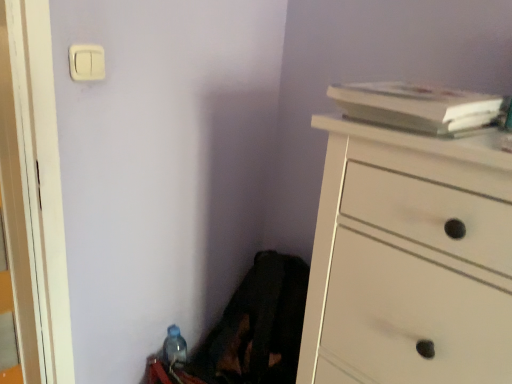
Question: Can we say translucent plastic bottle at lower left lies outside white matte book at upper right?

Choices:
 (A) yes
 (B) no

Answer: (A)

Question: From a real-world perspective, is translucent plastic bottle at lower left below white matte book at upper right?

Choices:
 (A) yes
 (B) no

Answer: (A)

Question: Does translucent plastic bottle at lower left have a lesser width compared to white matte book at upper right?

Choices:
 (A) yes
 (B) no

Answer: (A)

Question: Considering the relative sizes of translucent plastic bottle at lower left and white matte book at upper right in the image provided, is translucent plastic bottle at lower left smaller than white matte book at upper right?

Choices:
 (A) yes
 (B) no

Answer: (A)

Question: Is translucent plastic bottle at lower left facing towards white matte book at upper right?

Choices:
 (A) yes
 (B) no

Answer: (B)

Question: Is translucent plastic bottle at lower left shorter than white matte book at upper right?

Choices:
 (A) no
 (B) yes

Answer: (A)

Question: From a real-world perspective, is white matte book at upper right located higher than translucent plastic bottle at lower left?

Choices:
 (A) yes
 (B) no

Answer: (A)

Question: From the image's perspective, is white matte book at upper right located above translucent plastic bottle at lower left?

Choices:
 (A) yes
 (B) no

Answer: (A)

Question: Is the depth of white matte book at upper right less than that of translucent plastic bottle at lower left?

Choices:
 (A) no
 (B) yes

Answer: (B)

Question: Can you confirm if white matte book at upper right is shorter than translucent plastic bottle at lower left?

Choices:
 (A) yes
 (B) no

Answer: (A)

Question: Is white matte book at upper right bigger than translucent plastic bottle at lower left?

Choices:
 (A) no
 (B) yes

Answer: (B)

Question: Is white matte book at upper right facing towards translucent plastic bottle at lower left?

Choices:
 (A) no
 (B) yes

Answer: (A)

Question: Does white wood chest of drawers at right lie behind white matte book at upper right?

Choices:
 (A) yes
 (B) no

Answer: (B)